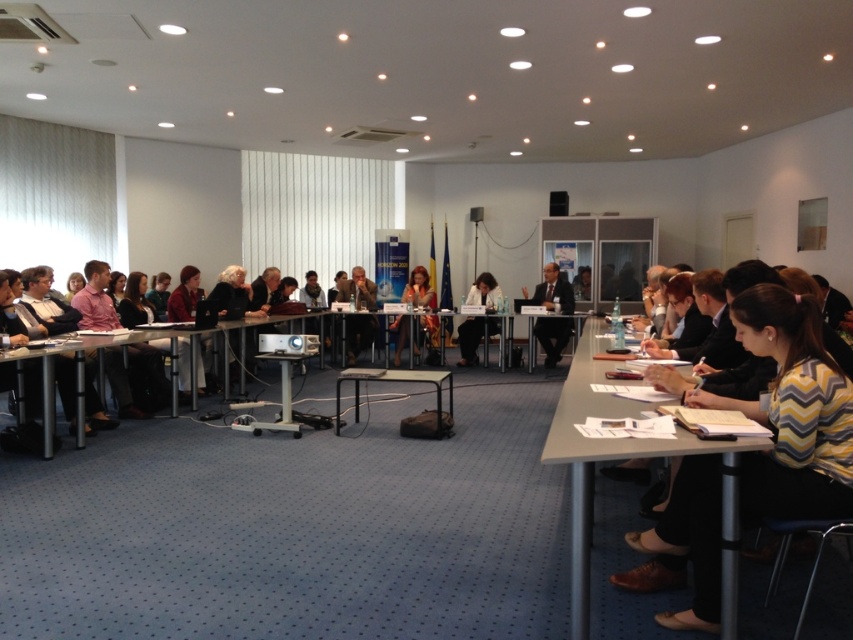
Does light gray plastic table at lower right have a greater height compared to metallic silver table at center?

Indeed, light gray plastic table at lower right has a greater height compared to metallic silver table at center.

Can you confirm if light gray plastic table at lower right is positioned above metallic silver table at center?

Indeed, light gray plastic table at lower right is positioned over metallic silver table at center.

The width and height of the screenshot is (853, 640). What do you see at coordinates (625, 458) in the screenshot?
I see `light gray plastic table at lower right` at bounding box center [625, 458].

Find the location of a particular element. light gray plastic table at lower right is located at coordinates (625, 458).

Can you confirm if dark suit at center is positioned below matte black dress at center?

No, dark suit at center is not below matte black dress at center.

In the scene shown: Is dark suit at center to the left of matte black dress at center from the viewer's perspective?

No, dark suit at center is not to the left of matte black dress at center.

Does point (567, 304) come farther from viewer compared to point (396, 321)?

That is False.

Where is `dark suit at center`? The image size is (853, 640). dark suit at center is located at coordinates (552, 291).

Does dark suit at center have a larger size compared to white paper at center?

Indeed, dark suit at center has a larger size compared to white paper at center.

Between dark suit at center and white paper at center, which one is positioned lower?

white paper at center is lower down.

What do you see at coordinates (552, 291) in the screenshot?
I see `dark suit at center` at bounding box center [552, 291].

Locate an element on the screen. The width and height of the screenshot is (853, 640). dark suit at center is located at coordinates (552, 291).